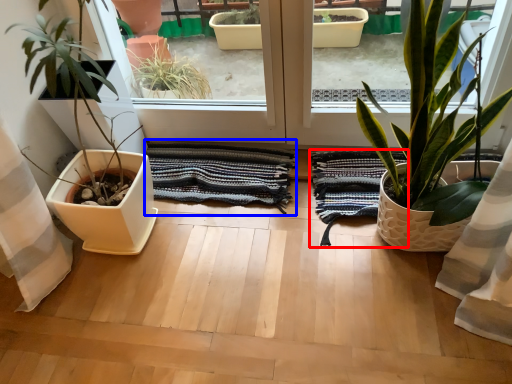
Question: Which object is further to the camera taking this photo, bath towel (highlighted by a red box) or bath towel (highlighted by a blue box)?

Choices:
 (A) bath towel
 (B) bath towel

Answer: (B)